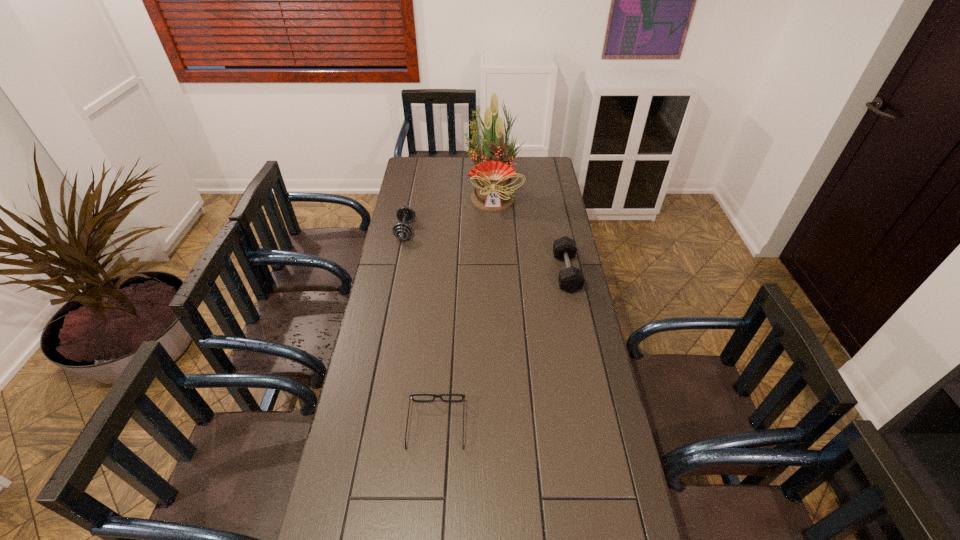
Identify the location of the farthest object. (492, 192).

Where is `the tallest object`? The image size is (960, 540). the tallest object is located at coordinates (492, 192).

I want to click on the rightmost object, so click(571, 279).

You are a GUI agent. You are given a task and a screenshot of the screen. Output one action in this format:
    pyautogui.click(x=<x>, y=<y>)
    Task: Click on the second nearest object
    The height and width of the screenshot is (540, 960).
    Given the screenshot: What is the action you would take?
    click(x=571, y=279)

Find the location of a particular element. the third tallest object is located at coordinates (402, 230).

Find the location of a particular element. The width and height of the screenshot is (960, 540). the second farthest object is located at coordinates (402, 230).

Locate an element on the screen. The height and width of the screenshot is (540, 960). the nearest object is located at coordinates (462, 395).

At what (x,y) coordinates should I click in order to perform the action: click on the shortest object. Please return your answer as a coordinate pair (x, y). Looking at the image, I should click on pos(462,395).

At what (x,y) coordinates should I click in order to perform the action: click on free space located in front of the farthest object with the fan visible. Please return your answer as a coordinate pair (x, y). Image resolution: width=960 pixels, height=540 pixels. Looking at the image, I should click on (495, 243).

This screenshot has width=960, height=540. What are the coordinates of `free space located on the left of the nearer dumbbell` in the screenshot? It's located at (536, 273).